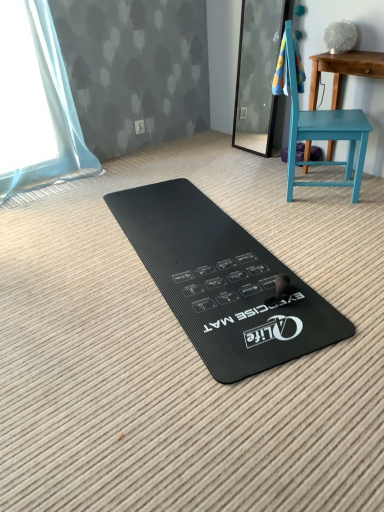
At what (x,y) coordinates should I click in order to perform the action: click on free location in front of teal matte chair at right. Please return your answer as a coordinate pair (x, y). The image size is (384, 512). Looking at the image, I should click on (322, 218).